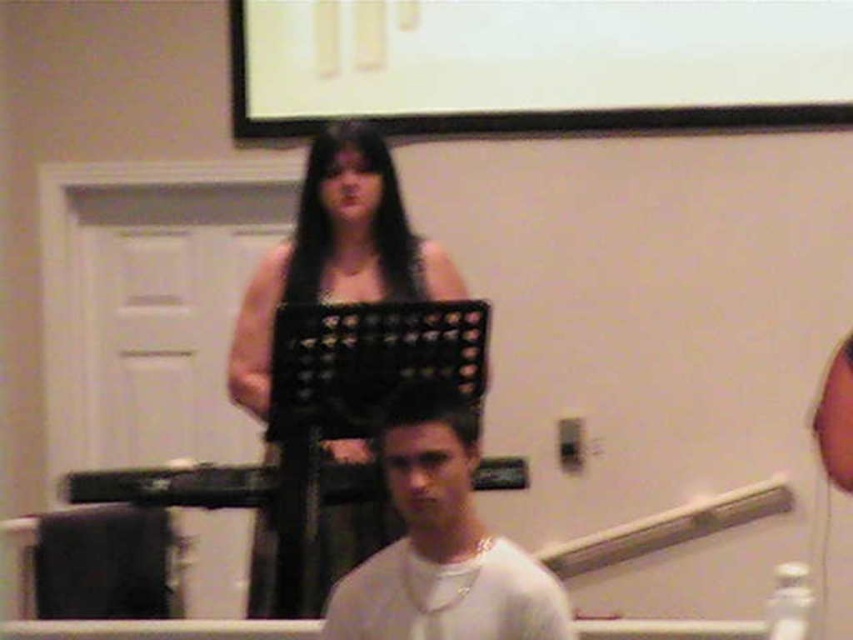
Question: Considering the real-world distances, which object is closest to the white matte shirt at center?

Choices:
 (A) black matte music stand at center
 (B) white matte projection screen at upper center

Answer: (A)

Question: Based on their relative distances, which object is farther from the white matte shirt at center?

Choices:
 (A) white matte projection screen at upper center
 (B) black matte music stand at center

Answer: (A)

Question: Does white matte projection screen at upper center appear under black matte music stand at center?

Choices:
 (A) no
 (B) yes

Answer: (A)

Question: Does black matte music stand at center have a larger size compared to white matte shirt at center?

Choices:
 (A) no
 (B) yes

Answer: (B)

Question: Which point is farther to the camera?

Choices:
 (A) white matte shirt at center
 (B) white matte projection screen at upper center
 (C) black matte music stand at center

Answer: (B)

Question: Considering the relative positions of black matte music stand at center and white matte shirt at center in the image provided, where is black matte music stand at center located with respect to white matte shirt at center?

Choices:
 (A) right
 (B) left

Answer: (B)